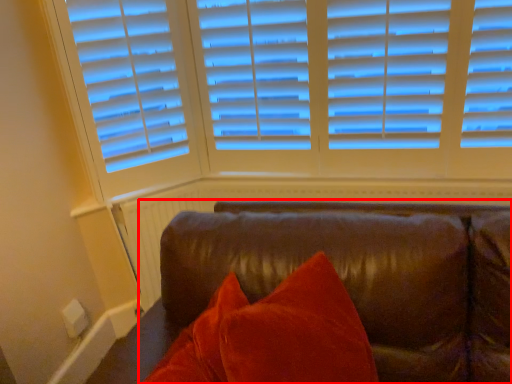
Question: In this image, where is studio couch (annotated by the red box) located relative to radiator?

Choices:
 (A) left
 (B) right

Answer: (B)